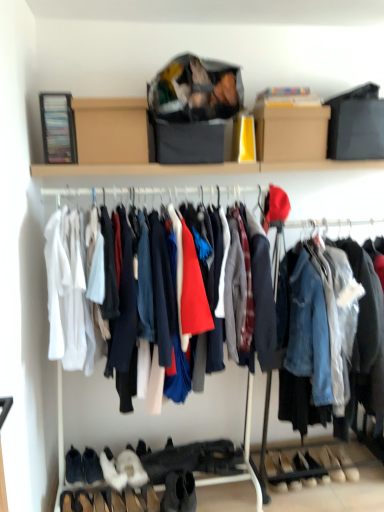
What do you see at coordinates (300, 462) in the screenshot?
I see `white suede shoes at lower center, placed as the 3th footwear when sorted from right to left` at bounding box center [300, 462].

Identify the location of white suede boot at lower left, which is counted as the seventh footwear, starting from the right. [112, 471].

At what (x,y) coordinates should I click in order to perform the action: click on leather beige shoe at lower center, the 2th shoe from the right. Please return your answer as a coordinate pair (x, y). Image resolution: width=384 pixels, height=512 pixels. Looking at the image, I should click on (272, 464).

Locate an element on the screen. black suede boot at lower left, which appears as the 8th footwear when viewed from the right is located at coordinates (92, 466).

Based on their sizes in the image, would you say white suede boot at lower left, which is the second footwear in left-to-right order, is bigger or smaller than leather shoes at lower center, the 5th footwear positioned from the left?

white suede boot at lower left, which is the second footwear in left-to-right order, is bigger than leather shoes at lower center, the 5th footwear positioned from the left.

Considering the positions of objects white suede boot at lower left, which is the second footwear in left-to-right order, and leather shoes at lower center, the 5th footwear positioned from the left, in the image provided, who is in front, white suede boot at lower left, which is the second footwear in left-to-right order, or leather shoes at lower center, the 5th footwear positioned from the left,?

white suede boot at lower left, which is the second footwear in left-to-right order.

Would you say white suede boot at lower left, which is counted as the seventh footwear, starting from the right, is to the left or to the right of leather shoes at lower center, the 5th footwear positioned from the left, in the picture?

Clearly, white suede boot at lower left, which is counted as the seventh footwear, starting from the right, is on the left of leather shoes at lower center, the 5th footwear positioned from the left, in the image.

Is white suede boot at lower left, which is counted as the seventh footwear, starting from the right, next to leather shoes at lower center, placed as the fourth footwear when sorted from right to left, and touching it?

No, white suede boot at lower left, which is counted as the seventh footwear, starting from the right, is not with leather shoes at lower center, placed as the fourth footwear when sorted from right to left.

Can you confirm if leather shoes at lower center, placed as the fourth footwear when sorted from right to left, is wider than white suede shoes at lower center, placed as the 3th footwear when sorted from right to left?

Correct, the width of leather shoes at lower center, placed as the fourth footwear when sorted from right to left, exceeds that of white suede shoes at lower center, placed as the 3th footwear when sorted from right to left.

Does leather shoes at lower center, the 5th footwear positioned from the left, appear on the left side of white suede shoes at lower center, arranged as the sixth footwear when viewed from the left?

Yes, leather shoes at lower center, the 5th footwear positioned from the left, is to the left of white suede shoes at lower center, arranged as the sixth footwear when viewed from the left.

Can you confirm if leather shoes at lower center, the 5th footwear positioned from the left, is smaller than white suede shoes at lower center, arranged as the sixth footwear when viewed from the left?

No.

From the image's perspective, is black suede boot at lower left, which appears as the 8th footwear when viewed from the right, beneath white suede shoe at lower right, which is the eighth footwear in left-to-right order?

Actually, black suede boot at lower left, which appears as the 8th footwear when viewed from the right, appears above white suede shoe at lower right, which is the eighth footwear in left-to-right order, in the image.

Identify the location of footwear that is the 7th object to the left of the white suede shoe at lower right, which is the eighth footwear in left-to-right order, starting at the anchor. This screenshot has width=384, height=512. (92, 466).

What's the angular difference between black suede boot at lower left, the 1th footwear in the left-to-right sequence, and white suede shoe at lower right, which is the eighth footwear in left-to-right order,'s facing directions?

4.91 degrees.

Considering the positions of point (269, 464) and point (308, 465), is point (269, 464) closer or farther from the camera than point (308, 465)?

Point (269, 464) is positioned closer to the camera compared to point (308, 465).

From their relative heights in the image, would you say leather beige shoe at lower center, the 1th shoe in the left-to-right sequence, is taller or shorter than leather shoe at lower center, which is counted as the first shoe, starting from the right?

In the image, leather beige shoe at lower center, the 1th shoe in the left-to-right sequence, appears to be taller than leather shoe at lower center, which is counted as the first shoe, starting from the right.

Based on their sizes in the image, would you say leather beige shoe at lower center, the 2th shoe from the right, is bigger or smaller than leather shoe at lower center, which is counted as the first shoe, starting from the right?

In the image, leather beige shoe at lower center, the 2th shoe from the right, appears to be larger than leather shoe at lower center, which is counted as the first shoe, starting from the right.

Considering the sizes of objects leather beige shoe at lower center, the 1th shoe in the left-to-right sequence, and leather shoe at lower center, which is counted as the first shoe, starting from the right, in the image provided, who is wider, leather beige shoe at lower center, the 1th shoe in the left-to-right sequence, or leather shoe at lower center, which is counted as the first shoe, starting from the right,?

leather beige shoe at lower center, the 1th shoe in the left-to-right sequence, is wider.

From the image's perspective, is white suede shoes at lower center, which is the 2th footwear in right-to-left order, positioned above or below leather beige shoe at lower center, the 1th shoe in the left-to-right sequence?

Based on their image positions, white suede shoes at lower center, which is the 2th footwear in right-to-left order, is located above leather beige shoe at lower center, the 1th shoe in the left-to-right sequence.

Which of these two, white suede shoes at lower center, which is the 2th footwear in right-to-left order, or leather beige shoe at lower center, the 2th shoe from the right, stands shorter?

Standing shorter between the two is white suede shoes at lower center, which is the 2th footwear in right-to-left order.

Considering the sizes of objects white suede shoes at lower center, which is the 2th footwear in right-to-left order, and leather beige shoe at lower center, the 1th shoe in the left-to-right sequence, in the image provided, who is bigger, white suede shoes at lower center, which is the 2th footwear in right-to-left order, or leather beige shoe at lower center, the 1th shoe in the left-to-right sequence,?

leather beige shoe at lower center, the 1th shoe in the left-to-right sequence.

From a real-world perspective, does white suede shoes at lower center, which is the 2th footwear in right-to-left order, sit lower than leather beige shoe at lower center, the 2th shoe from the right?

Yes.

Is white suede boot at lower left, which is counted as the seventh footwear, starting from the right, surrounding leather shoe at lower center, which is counted as the first shoe, starting from the right?

That's incorrect, leather shoe at lower center, which is counted as the first shoe, starting from the right, is not inside white suede boot at lower left, which is counted as the seventh footwear, starting from the right.

Is white suede boot at lower left, which is counted as the seventh footwear, starting from the right, looking in the opposite direction of leather shoe at lower center, the 2th shoe in the left-to-right sequence?

white suede boot at lower left, which is counted as the seventh footwear, starting from the right, does not have its back to leather shoe at lower center, the 2th shoe in the left-to-right sequence.

Who is more distant, white suede boot at lower left, which is the second footwear in left-to-right order, or leather shoe at lower center, the 2th shoe in the left-to-right sequence?

leather shoe at lower center, the 2th shoe in the left-to-right sequence, is more distant.

How distant is white suede boot at lower left, which is counted as the seventh footwear, starting from the right, from leather shoe at lower center, which is counted as the first shoe, starting from the right?

3.67 feet.

Considering the relative sizes of leather shoe at lower center, the 2th shoe in the left-to-right sequence, and leather beige shoe at lower center, the 2th shoe from the right, in the image provided, is leather shoe at lower center, the 2th shoe in the left-to-right sequence, shorter than leather beige shoe at lower center, the 2th shoe from the right,?

Yes.

Is leather shoe at lower center, which is counted as the first shoe, starting from the right, outside of leather beige shoe at lower center, the 1th shoe in the left-to-right sequence?

Yes, leather shoe at lower center, which is counted as the first shoe, starting from the right, is not within leather beige shoe at lower center, the 1th shoe in the left-to-right sequence.

From a real-world perspective, is leather shoe at lower center, the 2th shoe in the left-to-right sequence, above or below leather beige shoe at lower center, the 1th shoe in the left-to-right sequence?

Clearly, from a real-world perspective, leather shoe at lower center, the 2th shoe in the left-to-right sequence, is below leather beige shoe at lower center, the 1th shoe in the left-to-right sequence.

Is leather shoe at lower center, which is counted as the first shoe, starting from the right, oriented towards leather beige shoe at lower center, the 2th shoe from the right?

No, leather shoe at lower center, which is counted as the first shoe, starting from the right, does not turn towards leather beige shoe at lower center, the 2th shoe from the right.

Locate an element on the screen. footwear that is the 3rd one when counting leftward from the leather shoes at lower center, the 5th footwear positioned from the left is located at coordinates (112, 471).

Image resolution: width=384 pixels, height=512 pixels. I want to click on footwear that is the 1st object directly below the leather shoes at lower center, placed as the fourth footwear when sorted from right to left (from a real-world perspective), so 300,462.

Estimate the real-world distances between objects in this image. Which object is closer to leather shoe at lower center, the 2th shoe in the left-to-right sequence, black suede boot at lower center, which is counted as the 4th footwear, starting from the left, or white suede shoes at lower center, placed as the 3th footwear when sorted from right to left?

white suede shoes at lower center, placed as the 3th footwear when sorted from right to left, is closer to leather shoe at lower center, the 2th shoe in the left-to-right sequence.

When comparing their distances from white suede sneakers at lower center, which is counted as the sixth footwear, starting from the right, does cardboard box at upper center or white suede shoes at lower center, which is the 2th footwear in right-to-left order, seem further?

cardboard box at upper center.

Looking at the image, which one is located closer to white suede shoes at lower center, placed as the 3th footwear when sorted from right to left, cardboard box at upper center or black suede boot at lower left, the 1th footwear in the left-to-right sequence?

black suede boot at lower left, the 1th footwear in the left-to-right sequence, is closer to white suede shoes at lower center, placed as the 3th footwear when sorted from right to left.

Considering their positions, is black suede boot at lower left, the 1th footwear in the left-to-right sequence, positioned further to black suede boot at lower center, which is the 5th footwear from right to left, than leather shoe at lower center, the 2th shoe in the left-to-right sequence?

leather shoe at lower center, the 2th shoe in the left-to-right sequence, lies further to black suede boot at lower center, which is the 5th footwear from right to left, than the other object.

Estimate the real-world distances between objects in this image. Which object is further from white suede shoe at lower right, which is the eighth footwear in left-to-right order, leather shoes at lower center, placed as the fourth footwear when sorted from right to left, or white suede shoes at lower center, which is the 2th footwear in right-to-left order?

leather shoes at lower center, placed as the fourth footwear when sorted from right to left, is positioned further to the anchor white suede shoe at lower right, which is the eighth footwear in left-to-right order.

Looking at the image, which one is located further to black suede boot at lower left, which appears as the 8th footwear when viewed from the right, leather beige shoe at lower center, the 1th shoe in the left-to-right sequence, or leather shoes at lower center, placed as the fourth footwear when sorted from right to left?

leather shoes at lower center, placed as the fourth footwear when sorted from right to left, lies further to black suede boot at lower left, which appears as the 8th footwear when viewed from the right, than the other object.

Estimate the real-world distances between objects in this image. Which object is closer to leather beige shoe at lower center, the 1th shoe in the left-to-right sequence, black suede boot at lower center, which is the 5th footwear from right to left, or white suede shoes at lower center, marked as the seventh footwear in a left-to-right arrangement?

Among the two, white suede shoes at lower center, marked as the seventh footwear in a left-to-right arrangement, is located nearer to leather beige shoe at lower center, the 1th shoe in the left-to-right sequence.

Considering their positions, is cardboard box at upper center positioned closer to leather shoe at lower center, the 2th shoe in the left-to-right sequence, than white suede shoes at lower center, placed as the 3th footwear when sorted from right to left?

Among the two, white suede shoes at lower center, placed as the 3th footwear when sorted from right to left, is located nearer to leather shoe at lower center, the 2th shoe in the left-to-right sequence.

Identify the location of footwear located between leather shoes at lower center, the 5th footwear positioned from the left, and white suede shoes at lower center, marked as the seventh footwear in a left-to-right arrangement, in the left-right direction. This screenshot has height=512, width=384. (300, 462).

You are a GUI agent. You are given a task and a screenshot of the screen. Output one action in this format:
    pyautogui.click(x=<x>, y=<y>)
    Task: Click on the shoe between white suede sneakers at lower center, marked as the third footwear in a left-to-right arrangement, and leather shoes at lower center, the 5th footwear positioned from the left
    The image size is (384, 512).
    Given the screenshot: What is the action you would take?
    pyautogui.click(x=272, y=464)

You are a GUI agent. You are given a task and a screenshot of the screen. Output one action in this format:
    pyautogui.click(x=<x>, y=<y>)
    Task: Click on the footwear between white suede shoes at lower center, placed as the 3th footwear when sorted from right to left, and white suede shoe at lower right, which is the eighth footwear in left-to-right order
    The image size is (384, 512).
    Given the screenshot: What is the action you would take?
    pyautogui.click(x=332, y=464)

Where is `shoe between white suede sneakers at lower center, marked as the third footwear in a left-to-right arrangement, and leather shoe at lower center, the 2th shoe in the left-to-right sequence`? The width and height of the screenshot is (384, 512). shoe between white suede sneakers at lower center, marked as the third footwear in a left-to-right arrangement, and leather shoe at lower center, the 2th shoe in the left-to-right sequence is located at coordinates (272, 464).